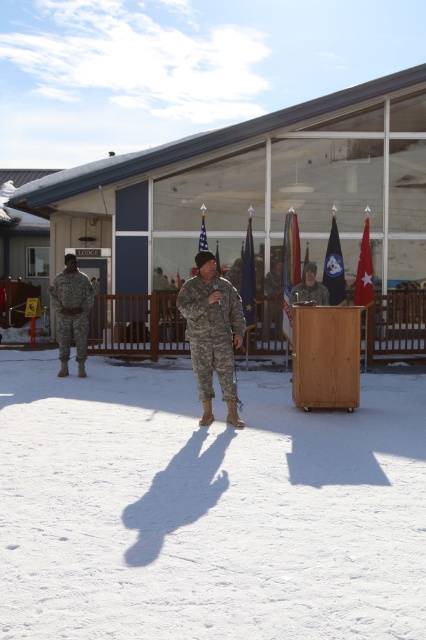
Question: Based on their relative distances, which object is nearer to the silky fabric flag at center?

Choices:
 (A) camouflage fabric uniform at left
 (B) white powdery snow at center
 (C) matte khaki uniform at center

Answer: (C)

Question: Estimate the real-world distances between objects in this image. Which object is farther from the camouflage fabric uniform at center?

Choices:
 (A) camouflage fabric uniform at left
 (B) silky fabric flag at center
 (C) dark blue fabric flag at center

Answer: (C)

Question: Can you confirm if camouflage fabric uniform at center is smaller than camouflage fabric uniform at left?

Choices:
 (A) no
 (B) yes

Answer: (A)

Question: Does camouflage fabric uniform at center appear on the left side of matte khaki uniform at center?

Choices:
 (A) yes
 (B) no

Answer: (A)

Question: Among these points, which one is nearest to the camera?

Choices:
 (A) (328, 250)
 (B) (287, 316)
 (C) (253, 320)

Answer: (B)

Question: Can you confirm if white powdery snow at center is positioned above camouflage fabric uniform at center?

Choices:
 (A) no
 (B) yes

Answer: (A)